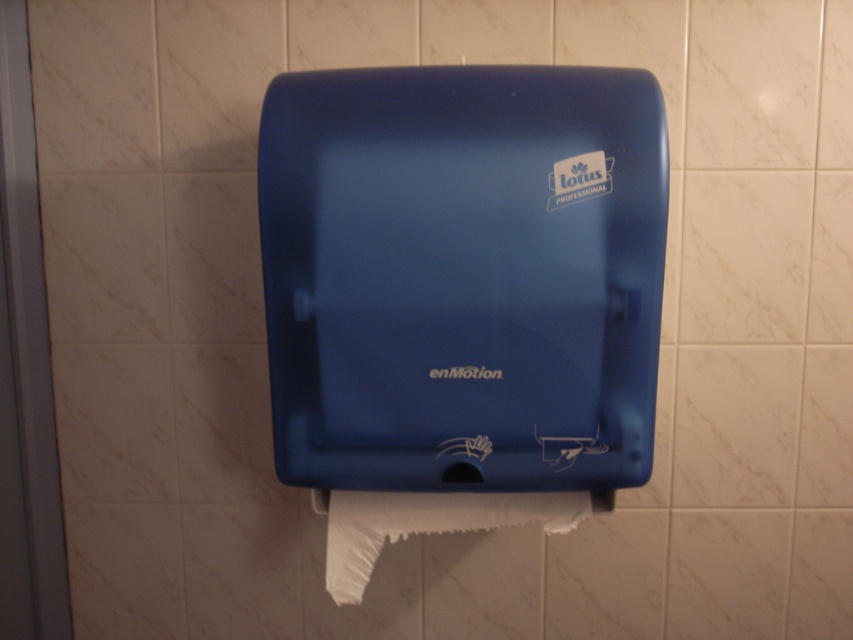
Question: Which of the following is the closest to the observer?

Choices:
 (A) white matte toilet paper at lower center
 (B) matte blue dispenser at center

Answer: (B)

Question: Is matte blue dispenser at center to the right of white matte toilet paper at lower center from the viewer's perspective?

Choices:
 (A) no
 (B) yes

Answer: (B)

Question: Is matte blue dispenser at center wider than white matte toilet paper at lower center?

Choices:
 (A) no
 (B) yes

Answer: (B)

Question: Which object appears closest to the camera in this image?

Choices:
 (A) white matte toilet paper at lower center
 (B) matte blue dispenser at center

Answer: (B)

Question: Is matte blue dispenser at center below white matte toilet paper at lower center?

Choices:
 (A) yes
 (B) no

Answer: (B)